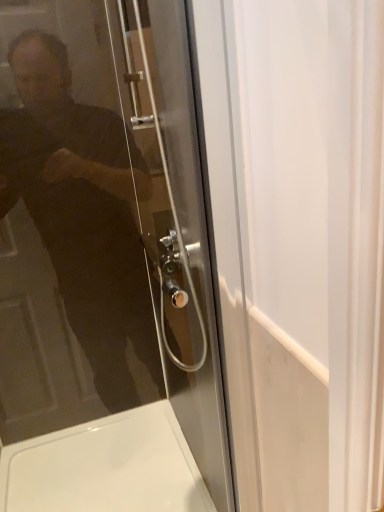
Question: Is white glossy bath at lower left in front of or behind transparent glass door at upper left in the image?

Choices:
 (A) behind
 (B) front

Answer: (A)

Question: Is white glossy bath at lower left to the left or to the right of transparent glass door at upper left in the image?

Choices:
 (A) right
 (B) left

Answer: (B)

Question: Is white glossy bath at lower left wider or thinner than transparent glass door at upper left?

Choices:
 (A) thin
 (B) wide

Answer: (B)

Question: From a real-world perspective, relative to white glossy bath at lower left, is transparent glass door at upper left vertically above or below?

Choices:
 (A) below
 (B) above

Answer: (B)

Question: In terms of width, does transparent glass door at upper left look wider or thinner when compared to white glossy bath at lower left?

Choices:
 (A) thin
 (B) wide

Answer: (A)

Question: Based on their positions, is transparent glass door at upper left located to the left or right of white glossy bath at lower left?

Choices:
 (A) right
 (B) left

Answer: (A)

Question: Considering the positions of transparent glass door at upper left and white glossy bath at lower left in the image, is transparent glass door at upper left bigger or smaller than white glossy bath at lower left?

Choices:
 (A) big
 (B) small

Answer: (B)